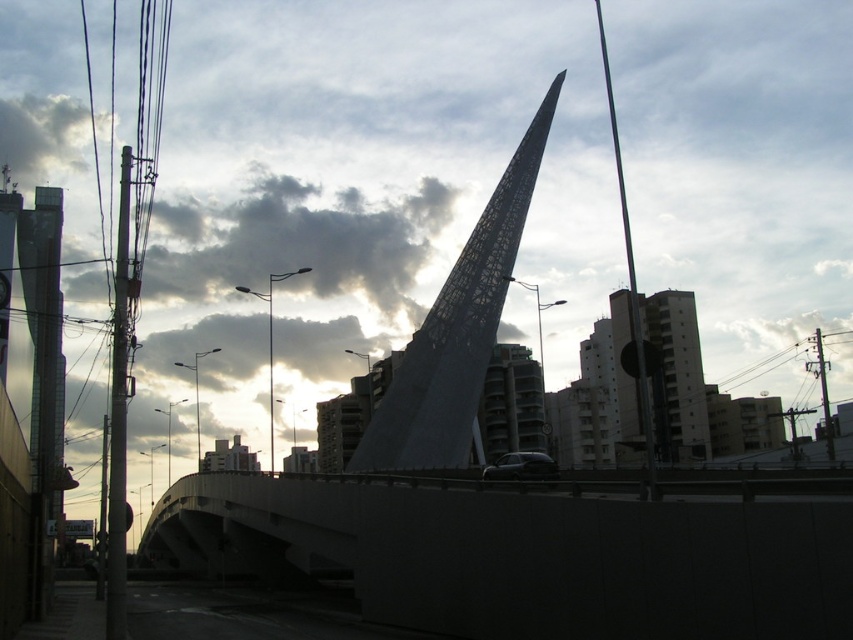
Question: Does concrete bridge at center appear under metallic lattice spire at center?

Choices:
 (A) yes
 (B) no

Answer: (A)

Question: Which of these objects is positioned closest to the metallic lattice spire at center?

Choices:
 (A) shiny black car at center
 (B) white concrete building at center
 (C) concrete bridge at center

Answer: (C)

Question: Among these objects, which one is farthest from the camera?

Choices:
 (A) metallic lattice spire at center
 (B) white concrete building at center
 (C) shiny black car at center
 (D) concrete bridge at center

Answer: (A)

Question: Is concrete bridge at center positioned before metallic lattice spire at center?

Choices:
 (A) yes
 (B) no

Answer: (A)

Question: Is white concrete building at center to the right of shiny black car at center from the viewer's perspective?

Choices:
 (A) yes
 (B) no

Answer: (A)

Question: Considering the real-world distances, which object is closest to the shiny black car at center?

Choices:
 (A) metallic lattice spire at center
 (B) white concrete building at center

Answer: (A)